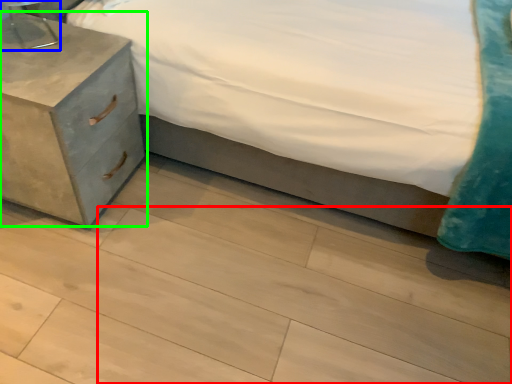
Question: Which object is the closest to the tile (highlighted by a red box)? Choose among these: table lamp (highlighted by a blue box) or nightstand (highlighted by a green box).

Choices:
 (A) table lamp
 (B) nightstand

Answer: (B)